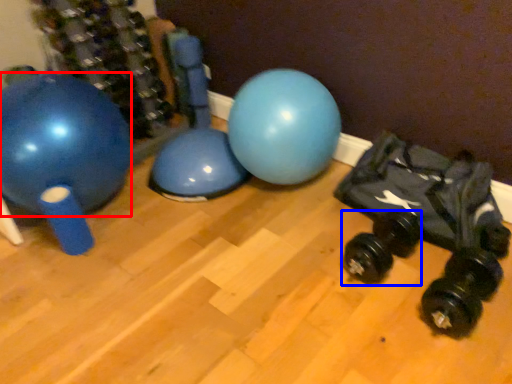
Question: Which object appears closest to the camera in this image, ball (highlighted by a red box) or dumbbell (highlighted by a blue box)?

Choices:
 (A) ball
 (B) dumbbell

Answer: (A)